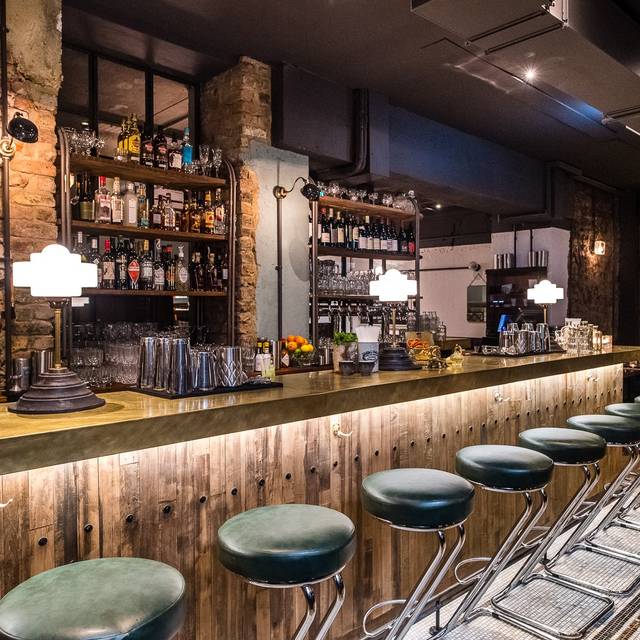
Image resolution: width=640 pixels, height=640 pixels. I want to click on lights, so click(x=58, y=267), click(x=399, y=285), click(x=548, y=290), click(x=598, y=250), click(x=528, y=73), click(x=20, y=128), click(x=310, y=189).